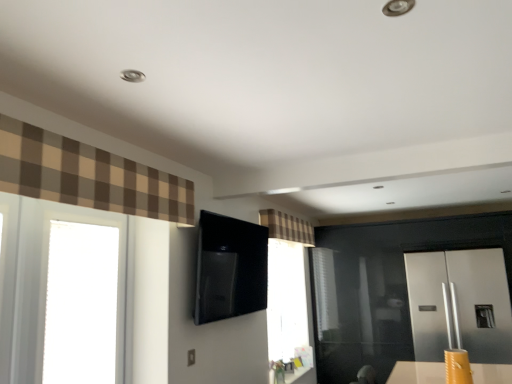
Question: From a real-world perspective, is brown plaid curtain at upper left, which is the second curtain in back-to-front order, above or below plaid fabric curtain at upper center, the first curtain in the right-to-left sequence?

Choices:
 (A) above
 (B) below

Answer: (B)

Question: Is point (6, 147) positioned closer to the camera than point (288, 240)?

Choices:
 (A) farther
 (B) closer

Answer: (B)

Question: Estimate the real-world distances between objects in this image. Which object is farther from the satin silver refrigerator at right?

Choices:
 (A) matte black outlet at lower center
 (B) transparent glass window at left
 (C) brown plaid curtain at upper left, which is counted as the first curtain, starting from the front
 (D) plaid fabric curtain at upper center, placed as the second curtain when sorted from front to back

Answer: (B)

Question: Estimate the real-world distances between objects in this image. Which object is farther from the plaid fabric curtain at upper center, acting as the second curtain starting from the top?

Choices:
 (A) satin silver refrigerator at right
 (B) brown plaid curtain at upper left, which is the second curtain in back-to-front order
 (C) transparent glass window at left
 (D) matte black outlet at lower center

Answer: (B)